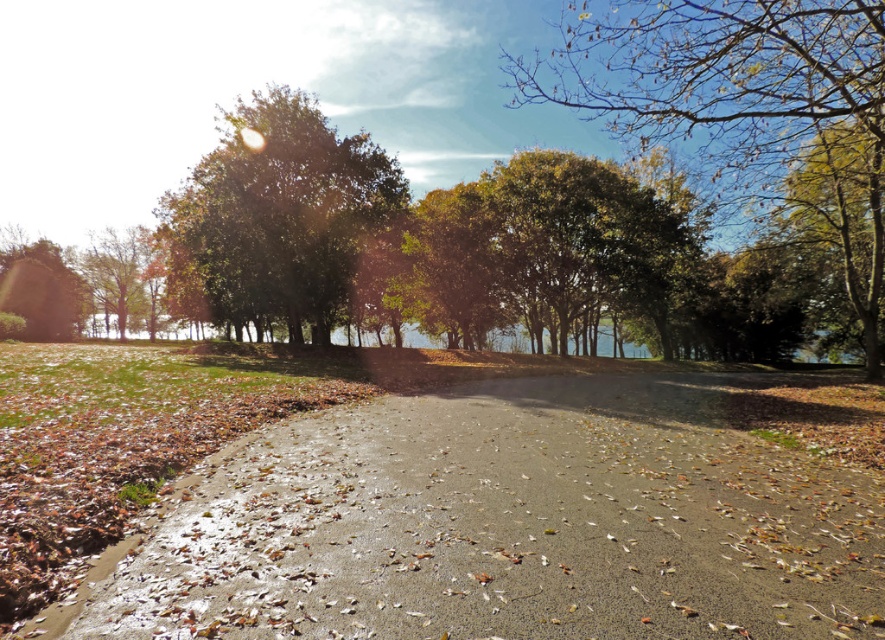
Is green leafy tree at upper center positioned before green matte tree at lower left?

Yes, it is in front of green matte tree at lower left.

Is point (833, 13) positioned after point (75, 292)?

No, (833, 13) is closer to viewer.

At what (x,y) coordinates should I click in order to perform the action: click on green leafy tree at upper center. Please return your answer as a coordinate pair (x, y). The width and height of the screenshot is (885, 640). Looking at the image, I should click on (747, 108).

This screenshot has width=885, height=640. What are the coordinates of `green leafy tree at upper center` in the screenshot? It's located at (747, 108).

Is point (466, 611) more distant than point (13, 289)?

No, it is not.

Identify the location of gray asphalt road at center. The width and height of the screenshot is (885, 640). (514, 522).

Is point (291, 257) closer to camera compared to point (0, 288)?

Yes.

You are a GUI agent. You are given a task and a screenshot of the screen. Output one action in this format:
    pyautogui.click(x=<x>, y=<y>)
    Task: Click on the green leafy tree at upper left
    The height and width of the screenshot is (640, 885).
    Given the screenshot: What is the action you would take?
    pyautogui.click(x=276, y=220)

Is point (358, 140) closer to camera compared to point (33, 276)?

Yes, it is in front of point (33, 276).

I want to click on green leafy tree at upper left, so click(276, 220).